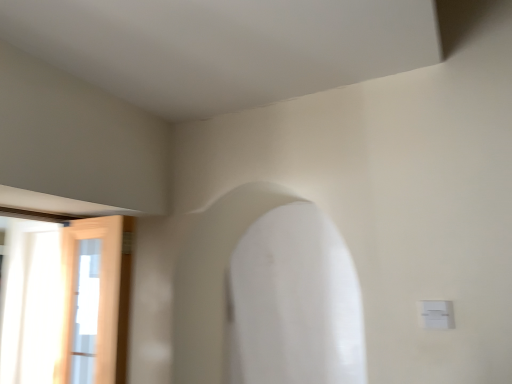
Where is `white smooth archway at center`? The image size is (512, 384). white smooth archway at center is located at coordinates (266, 295).

Identify the location of white smooth archway at center. (266, 295).

Looking at this image, from a real-world perspective, is wooden door at left located higher than white smooth archway at center?

Incorrect, from a real-world perspective, wooden door at left is lower than white smooth archway at center.

From the image's perspective, would you say wooden door at left is positioned over white smooth archway at center?

No.

Locate an element on the screen. door behind the white smooth archway at center is located at coordinates (95, 299).

Which is behind, wooden door at left or white smooth archway at center?

wooden door at left.

From a real-world perspective, who is located higher, white smooth archway at center or wooden door at left?

white smooth archway at center, from a real-world perspective.

From the image's perspective, is white smooth archway at center above wooden door at left?

Yes.

Considering the positions of objects white smooth archway at center and wooden door at left in the image provided, who is more to the right, white smooth archway at center or wooden door at left?

white smooth archway at center.

Does white smooth archway at center have a lesser height compared to wooden door at left?

Correct, white smooth archway at center is not as tall as wooden door at left.

Considering the sizes of objects white plastic electric outlet at lower right and white smooth archway at center in the image provided, who is bigger, white plastic electric outlet at lower right or white smooth archway at center?

white smooth archway at center is bigger.

Image resolution: width=512 pixels, height=384 pixels. I want to click on archway located behind the white plastic electric outlet at lower right, so click(266, 295).

Which is behind, white plastic electric outlet at lower right or white smooth archway at center?

white smooth archway at center is behind.

Does point (429, 306) lie behind point (232, 315)?

That is False.

From the image's perspective, is white plastic electric outlet at lower right located above wooden door at left?

Yes, from the image's perspective, white plastic electric outlet at lower right is on top of wooden door at left.

Between point (424, 316) and point (115, 255), which one is positioned in front?

Point (424, 316)

Is white plastic electric outlet at lower right looking in the opposite direction of wooden door at left?

No, white plastic electric outlet at lower right's orientation is not away from wooden door at left.

Identify the location of electric outlet in front of the wooden door at left. (436, 314).

Between wooden door at left and white plastic electric outlet at lower right, which one has less height?

white plastic electric outlet at lower right.

Considering the positions of objects wooden door at left and white plastic electric outlet at lower right in the image provided, who is in front, wooden door at left or white plastic electric outlet at lower right?

white plastic electric outlet at lower right.

Does wooden door at left turn towards white plastic electric outlet at lower right?

No, wooden door at left does not turn towards white plastic electric outlet at lower right.

Are wooden door at left and white plastic electric outlet at lower right located far from each other?

Yes, wooden door at left is far from white plastic electric outlet at lower right.

The width and height of the screenshot is (512, 384). Find the location of `electric outlet below the white smooth archway at center (from a real-world perspective)`. electric outlet below the white smooth archway at center (from a real-world perspective) is located at coordinates (436, 314).

From a real-world perspective, which object stands above the other?

white smooth archway at center is physically above.

Which object is further away from the camera taking this photo, white smooth archway at center or white plastic electric outlet at lower right?

white smooth archway at center is more distant.

Where is `archway on the right of wooden door at left`? The width and height of the screenshot is (512, 384). archway on the right of wooden door at left is located at coordinates (266, 295).

Identify the location of door below the white smooth archway at center (from a real-world perspective). (95, 299).

Looking at the image, which one is located closer to white plastic electric outlet at lower right, white smooth archway at center or wooden door at left?

The object closer to white plastic electric outlet at lower right is white smooth archway at center.

Based on their spatial positions, is white smooth archway at center or white plastic electric outlet at lower right closer to wooden door at left?

The object closer to wooden door at left is white smooth archway at center.

Which object lies further to the anchor point white smooth archway at center, wooden door at left or white plastic electric outlet at lower right?

white plastic electric outlet at lower right is positioned further to the anchor white smooth archway at center.

Which object lies further to the anchor point wooden door at left, white plastic electric outlet at lower right or white smooth archway at center?

white plastic electric outlet at lower right.

Considering their positions, is wooden door at left positioned closer to white plastic electric outlet at lower right than white smooth archway at center?

white smooth archway at center lies closer to white plastic electric outlet at lower right than the other object.

From the image, which object appears to be farther from white smooth archway at center, white plastic electric outlet at lower right or wooden door at left?

white plastic electric outlet at lower right lies further to white smooth archway at center than the other object.

At what (x,y) coordinates should I click in order to perform the action: click on archway between wooden door at left and white plastic electric outlet at lower right. Please return your answer as a coordinate pair (x, y). The image size is (512, 384). Looking at the image, I should click on (266, 295).